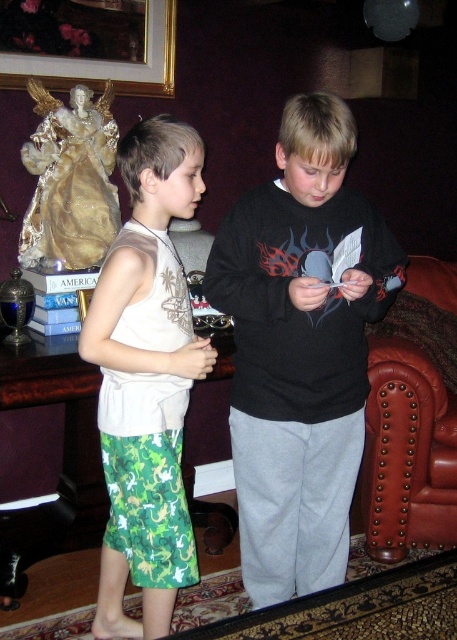
Question: Which object is closer to the camera taking this photo?

Choices:
 (A) black matte sweatshirt at center
 (B) leather studded armchair at right
 (C) green printed shorts at left
 (D) goldmetallicpicture frame at upper left

Answer: (A)

Question: Is black matte sweatshirt at center closer to camera compared to green printed shorts at left?

Choices:
 (A) yes
 (B) no

Answer: (A)

Question: Can you confirm if green printed shorts at left is positioned above goldmetallicpicture frame at upper left?

Choices:
 (A) no
 (B) yes

Answer: (A)

Question: Which point appears farthest from the camera in this image?

Choices:
 (A) (285, 561)
 (B) (160, 292)
 (C) (47, 74)

Answer: (C)

Question: Does leather studded armchair at right lie in front of goldmetallicpicture frame at upper left?

Choices:
 (A) no
 (B) yes

Answer: (B)

Question: Which object is closer to the camera taking this photo?

Choices:
 (A) leather studded armchair at right
 (B) black matte sweatshirt at center

Answer: (B)